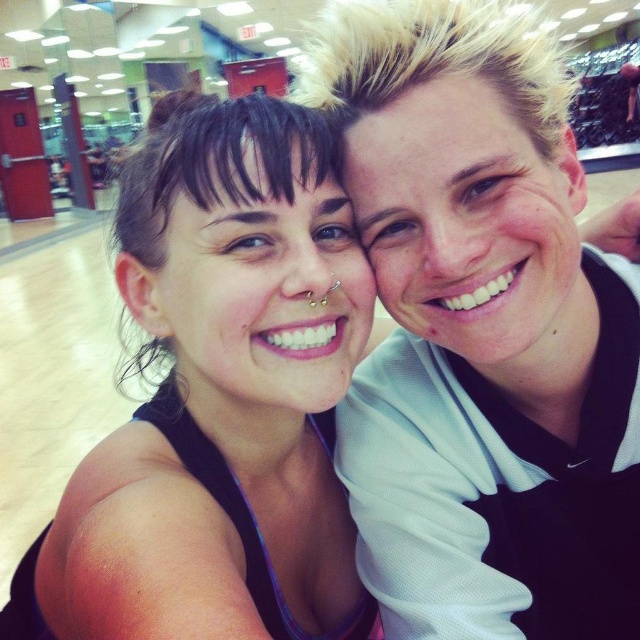
Who is shorter, black mesh shirt at upper right or black matte tank top at center?

Standing shorter between the two is black matte tank top at center.

Describe the element at coordinates (481, 332) in the screenshot. The width and height of the screenshot is (640, 640). I see `black mesh shirt at upper right` at that location.

Between point (636, 248) and point (67, 616), which one is positioned in front?

Point (67, 616) is in front.

Locate an element on the screen. This screenshot has width=640, height=640. black mesh shirt at upper right is located at coordinates (481, 332).